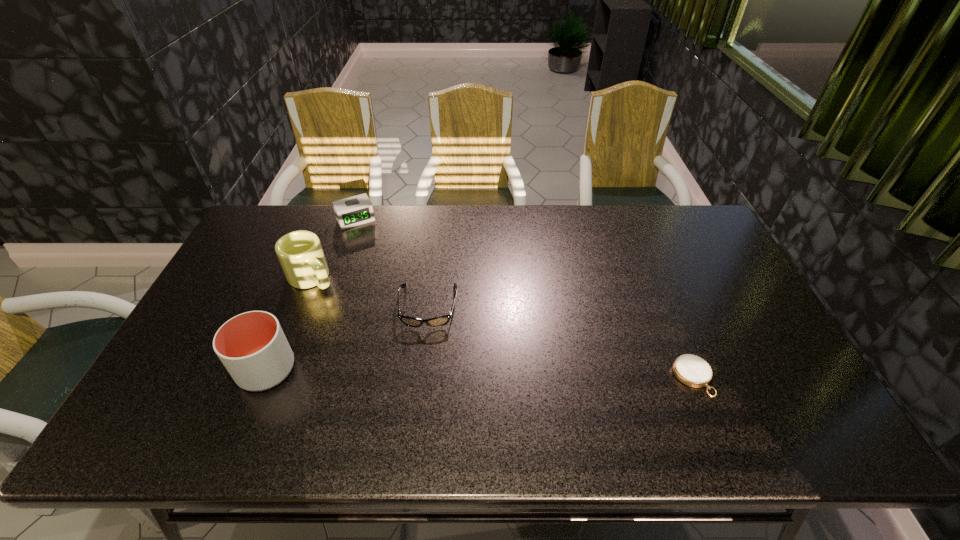
You are a GUI agent. You are given a task and a screenshot of the screen. Output one action in this format:
    pyautogui.click(x=<x>, y=<y>)
    Task: Click on the free space located 0.160m on the front-facing side of the second object from right to left
    
    Given the screenshot: What is the action you would take?
    pyautogui.click(x=420, y=382)

I want to click on blank area located 0.120m on the front-facing side of the second object from right to left, so click(x=421, y=368).

I want to click on free location located 0.180m on the front-facing side of the second object from right to left, so (420, 389).

The image size is (960, 540). I want to click on vacant space located on the front-facing side of the third tallest object, so click(388, 277).

Identify the location of vacant space located on the front-facing side of the third tallest object. Image resolution: width=960 pixels, height=540 pixels. (393, 287).

Where is `free space located on the front-facing side of the third tallest object`? The height and width of the screenshot is (540, 960). free space located on the front-facing side of the third tallest object is located at coordinates (391, 283).

The height and width of the screenshot is (540, 960). What are the coordinates of `vacant area located 0.200m with the handle on the side of the mug` in the screenshot? It's located at (366, 326).

You are a GUI agent. You are given a task and a screenshot of the screen. Output one action in this format:
    pyautogui.click(x=<x>, y=<y>)
    Task: Click on the vacant space located with the handle on the side of the mug
    
    Given the screenshot: What is the action you would take?
    pyautogui.click(x=337, y=300)

You are a GUI agent. You are given a task and a screenshot of the screen. Output one action in this format:
    pyautogui.click(x=<x>, y=<y>)
    Task: Click on the vacant space located with the handle on the side of the mug
    This screenshot has height=540, width=960.
    Given the screenshot: What is the action you would take?
    pyautogui.click(x=383, y=341)

You are a GUI agent. You are given a task and a screenshot of the screen. Output one action in this format:
    pyautogui.click(x=<x>, y=<y>)
    Task: Click on the object at the far edge
    The height and width of the screenshot is (540, 960).
    Given the screenshot: What is the action you would take?
    pyautogui.click(x=356, y=210)